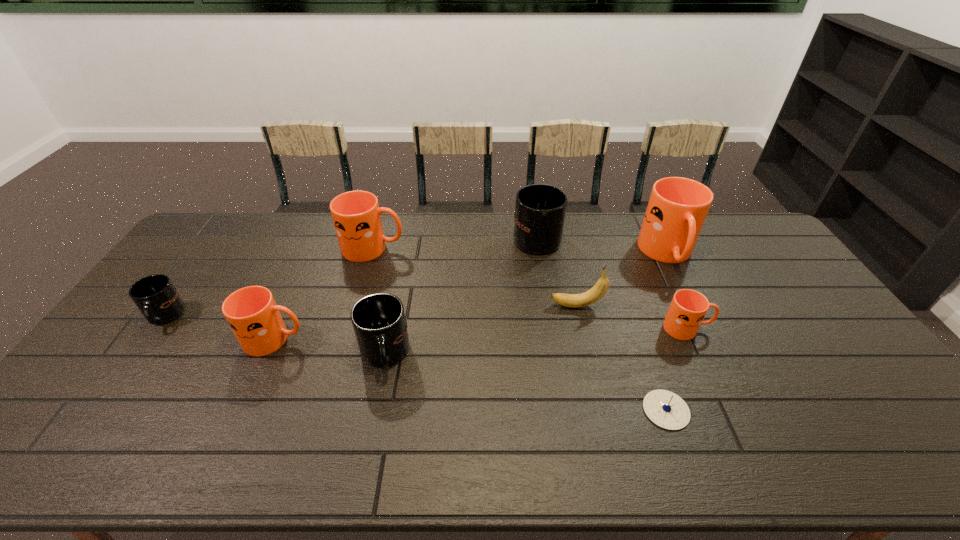
The height and width of the screenshot is (540, 960). Find the location of `the tallest object`. the tallest object is located at coordinates (677, 208).

Image resolution: width=960 pixels, height=540 pixels. Identify the location of the tallest mug. (677, 208).

At what (x,y) coordinates should I click in order to perform the action: click on the second biggest orange mug. Please return your answer as a coordinate pair (x, y). The width and height of the screenshot is (960, 540). Looking at the image, I should click on (356, 215).

This screenshot has height=540, width=960. I want to click on the rightmost black mug, so click(x=540, y=209).

Identify the location of the biggest black mug. This screenshot has height=540, width=960. (540, 209).

At what (x,y) coordinates should I click in order to perform the action: click on banana. Please return your answer as a coordinate pair (x, y). Image resolution: width=960 pixels, height=540 pixels. Looking at the image, I should click on (591, 296).

You are a GUI agent. You are given a task and a screenshot of the screen. Output one action in this format:
    pyautogui.click(x=<x>, y=<y>)
    Task: Click on the second mug from left to right
    The image size is (960, 540).
    Given the screenshot: What is the action you would take?
    pyautogui.click(x=251, y=312)

This screenshot has height=540, width=960. Find the location of `the third biggest orange mug`. the third biggest orange mug is located at coordinates (251, 312).

Where is `the second biggest black mug`? the second biggest black mug is located at coordinates (379, 322).

You are a GUI agent. You are given a task and a screenshot of the screen. Output one action in this format:
    pyautogui.click(x=<x>, y=<y>)
    Task: Click on the smallest orange mug
    The image size is (960, 540).
    Given the screenshot: What is the action you would take?
    [x=685, y=315]